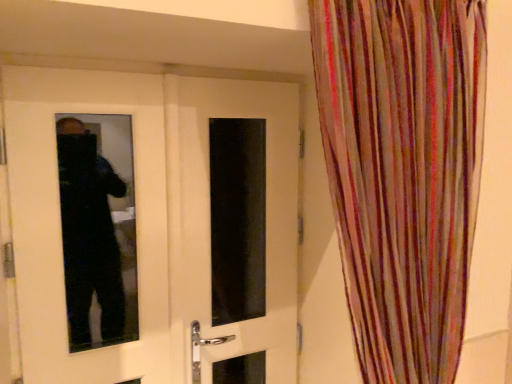
What do you see at coordinates (153, 226) in the screenshot? I see `white glossy door at center, the 2th door in the right-to-left sequence` at bounding box center [153, 226].

Consider the image. What is the approximate width of multicolored sheer curtain at right?

multicolored sheer curtain at right is 9.12 inches wide.

Locate an element on the screen. The width and height of the screenshot is (512, 384). multicolored sheer curtain at right is located at coordinates (403, 172).

This screenshot has height=384, width=512. Identify the location of white glossy door at center, which is counted as the first door, starting from the right. (215, 225).

Find the location of a particular element. Image resolution: width=512 pixels, height=384 pixels. white glossy door at center, the 2th door in the right-to-left sequence is located at coordinates (153, 226).

Which object is positioned more to the right, white glossy door at center, the 2th door positioned from the left, or white glossy door at center, the 2th door in the right-to-left sequence?

white glossy door at center, the 2th door positioned from the left.

Can you tell me how much white glossy door at center, which is counted as the first door, starting from the right, and white glossy door at center, the 2th door in the right-to-left sequence, differ in facing direction?

There is a 0.00161-degree angle between the facing directions of white glossy door at center, which is counted as the first door, starting from the right, and white glossy door at center, the 2th door in the right-to-left sequence.

Is white glossy door at center, the 2th door positioned from the left, positioned with its back to white glossy door at center, which appears as the 1th door when viewed from the left?

Yes.

Between white glossy door at center, which is counted as the first door, starting from the right, and white glossy door at center, which appears as the 1th door when viewed from the left, which one has larger size?

Bigger between the two is white glossy door at center, which appears as the 1th door when viewed from the left.

Who is smaller, multicolored sheer curtain at right or white glossy door at center, which appears as the 1th door when viewed from the left?

white glossy door at center, which appears as the 1th door when viewed from the left.

In order to click on curtain in front of the white glossy door at center, which appears as the 1th door when viewed from the left in this screenshot , I will do `click(403, 172)`.

In the scene shown: Which object is positioned more to the right, multicolored sheer curtain at right or white glossy door at center, which appears as the 1th door when viewed from the left?

Positioned to the right is multicolored sheer curtain at right.

Is multicolored sheer curtain at right with white glossy door at center, which appears as the 1th door when viewed from the left?

No.

Would you say white glossy door at center, the 2th door positioned from the left, is part of multicolored sheer curtain at right's contents?

No, white glossy door at center, the 2th door positioned from the left, is not surrounded by multicolored sheer curtain at right.

How different are the orientations of multicolored sheer curtain at right and white glossy door at center, which is counted as the first door, starting from the right, in degrees?

They differ by 0.855 degrees in their facing directions.

Considering the sizes of multicolored sheer curtain at right and white glossy door at center, the 2th door positioned from the left, in the image, is multicolored sheer curtain at right wider or thinner than white glossy door at center, the 2th door positioned from the left,?

Clearly, multicolored sheer curtain at right has more width compared to white glossy door at center, the 2th door positioned from the left.

Identify the location of curtain in front of the white glossy door at center, the 2th door positioned from the left. This screenshot has height=384, width=512. (403, 172).

Could you tell me if white glossy door at center, which appears as the 1th door when viewed from the left, is facing white glossy door at center, which is counted as the first door, starting from the right?

Yes, white glossy door at center, which appears as the 1th door when viewed from the left, is aimed at white glossy door at center, which is counted as the first door, starting from the right.

At what (x,y) coordinates should I click in order to perform the action: click on door behind the white glossy door at center, which appears as the 1th door when viewed from the left. Please return your answer as a coordinate pair (x, y). Image resolution: width=512 pixels, height=384 pixels. Looking at the image, I should click on (215, 225).

Is white glossy door at center, the 2th door in the right-to-left sequence, to the left or to the right of white glossy door at center, which is counted as the first door, starting from the right, in the image?

From the image, it's evident that white glossy door at center, the 2th door in the right-to-left sequence, is to the left of white glossy door at center, which is counted as the first door, starting from the right.

From a real-world perspective, is white glossy door at center, the 2th door in the right-to-left sequence, positioned under white glossy door at center, which is counted as the first door, starting from the right, based on gravity?

Actually, white glossy door at center, the 2th door in the right-to-left sequence, is physically above white glossy door at center, which is counted as the first door, starting from the right, in the real world.

Considering the sizes of objects white glossy door at center, the 2th door in the right-to-left sequence, and multicolored sheer curtain at right in the image provided, who is shorter, white glossy door at center, the 2th door in the right-to-left sequence, or multicolored sheer curtain at right?

With less height is multicolored sheer curtain at right.

How different are the orientations of white glossy door at center, the 2th door in the right-to-left sequence, and multicolored sheer curtain at right in degrees?

0.855 degrees separate the facing orientations of white glossy door at center, the 2th door in the right-to-left sequence, and multicolored sheer curtain at right.

Can you confirm if white glossy door at center, the 2th door in the right-to-left sequence, is positioned to the left of multicolored sheer curtain at right?

Yes, white glossy door at center, the 2th door in the right-to-left sequence, is to the left of multicolored sheer curtain at right.

From the image's perspective, does white glossy door at center, the 2th door in the right-to-left sequence, appear higher than multicolored sheer curtain at right?

No, from the image's perspective, white glossy door at center, the 2th door in the right-to-left sequence, is not on top of multicolored sheer curtain at right.

From the image's perspective, is white glossy door at center, which is counted as the first door, starting from the right, located above or below multicolored sheer curtain at right?

Based on their image positions, white glossy door at center, which is counted as the first door, starting from the right, is located beneath multicolored sheer curtain at right.

Is white glossy door at center, which is counted as the first door, starting from the right, in front of multicolored sheer curtain at right?

No, white glossy door at center, which is counted as the first door, starting from the right, is behind multicolored sheer curtain at right.

Is white glossy door at center, which is counted as the first door, starting from the right, thinner than multicolored sheer curtain at right?

Indeed, white glossy door at center, which is counted as the first door, starting from the right, has a lesser width compared to multicolored sheer curtain at right.

Is white glossy door at center, the 2th door positioned from the left, next to multicolored sheer curtain at right?

white glossy door at center, the 2th door positioned from the left, and multicolored sheer curtain at right are not in contact.

I want to click on door lying behind the white glossy door at center, which appears as the 1th door when viewed from the left, so click(215, 225).

Where is `door that is the 1st one below the multicolored sheer curtain at right (from a real-world perspective)`? This screenshot has width=512, height=384. door that is the 1st one below the multicolored sheer curtain at right (from a real-world perspective) is located at coordinates (153, 226).

Looking at the image, which one is located further to white glossy door at center, the 2th door in the right-to-left sequence, white glossy door at center, the 2th door positioned from the left, or multicolored sheer curtain at right?

multicolored sheer curtain at right is positioned further to the anchor white glossy door at center, the 2th door in the right-to-left sequence.

When comparing their distances from white glossy door at center, the 2th door in the right-to-left sequence, does multicolored sheer curtain at right or white glossy door at center, which is counted as the first door, starting from the right, seem closer?

white glossy door at center, which is counted as the first door, starting from the right, is closer to white glossy door at center, the 2th door in the right-to-left sequence.

Looking at the image, which one is located further to white glossy door at center, the 2th door positioned from the left, white glossy door at center, the 2th door in the right-to-left sequence, or multicolored sheer curtain at right?

multicolored sheer curtain at right.

When comparing their distances from white glossy door at center, which is counted as the first door, starting from the right, does multicolored sheer curtain at right or white glossy door at center, which appears as the 1th door when viewed from the left, seem further?

Among the two, multicolored sheer curtain at right is located further to white glossy door at center, which is counted as the first door, starting from the right.

From the picture: When comparing their distances from multicolored sheer curtain at right, does white glossy door at center, which is counted as the first door, starting from the right, or white glossy door at center, the 2th door in the right-to-left sequence, seem closer?

white glossy door at center, which is counted as the first door, starting from the right, is positioned closer to the anchor multicolored sheer curtain at right.

From the image, which object appears to be farther from multicolored sheer curtain at right, white glossy door at center, the 2th door in the right-to-left sequence, or white glossy door at center, the 2th door positioned from the left?

white glossy door at center, the 2th door in the right-to-left sequence, lies further to multicolored sheer curtain at right than the other object.

Identify the location of door between multicolored sheer curtain at right and white glossy door at center, which is counted as the first door, starting from the right, from front to back. The image size is (512, 384). (153, 226).